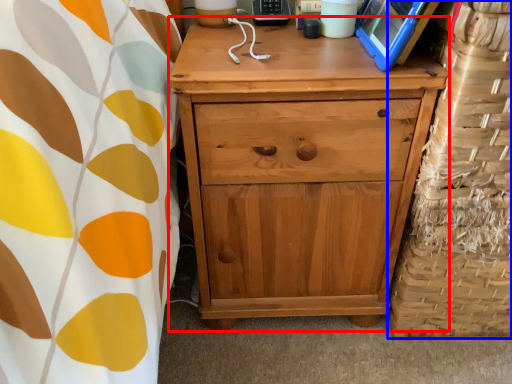
Question: Which point is further to the camera, chest of drawers (highlighted by a red box) or basket (highlighted by a blue box)?

Choices:
 (A) chest of drawers
 (B) basket

Answer: (A)